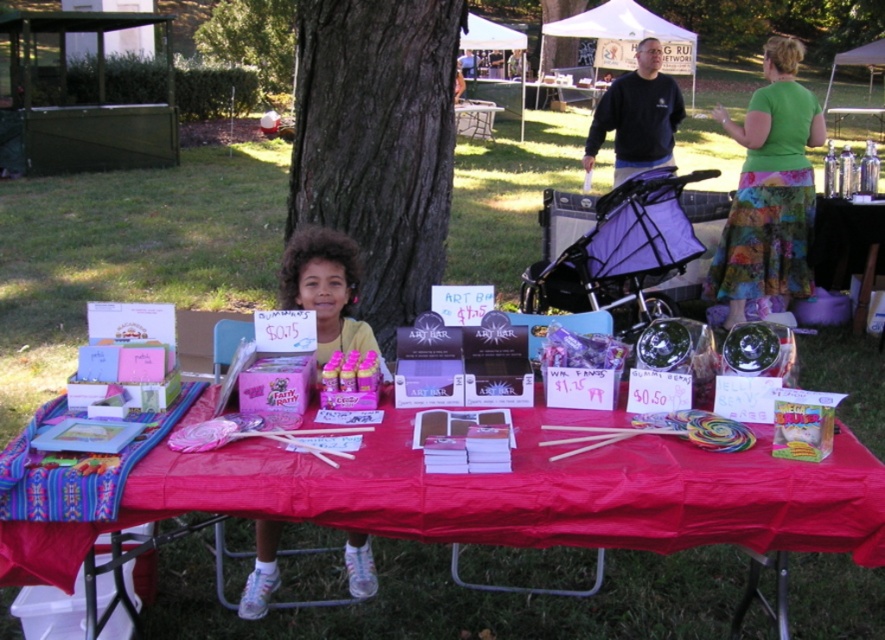
Consider the image. You are a visitor at the fair and want to buy something from the table. The items on the table are displayed under the brown rough bark tree at center. Are the items on the table under or above the matte yellow shirt at center?

The items on the table are under the brown rough bark tree at center, and since the brown rough bark tree at center is above the matte yellow shirt at center, the items are also above the matte yellow shirt at center.

You are a customer at the fair and want to buy the item with the largest size between the green textured skirt at upper right and the matte yellow shirt at center. Which one should you choose?

The green textured skirt at upper right has a larger size compared to the matte yellow shirt at center, so you should choose the green textured skirt at upper right.

You are a customer at the fair and want to buy something from the table. You notice two items on the table that catch your eye. One is the green textured skirt at upper right and the other is the matte yellow shirt at center. Which item is positioned higher up on the table?

The green textured skirt at upper right is positioned higher up on the table than the matte yellow shirt at center because it is above it according to the description.